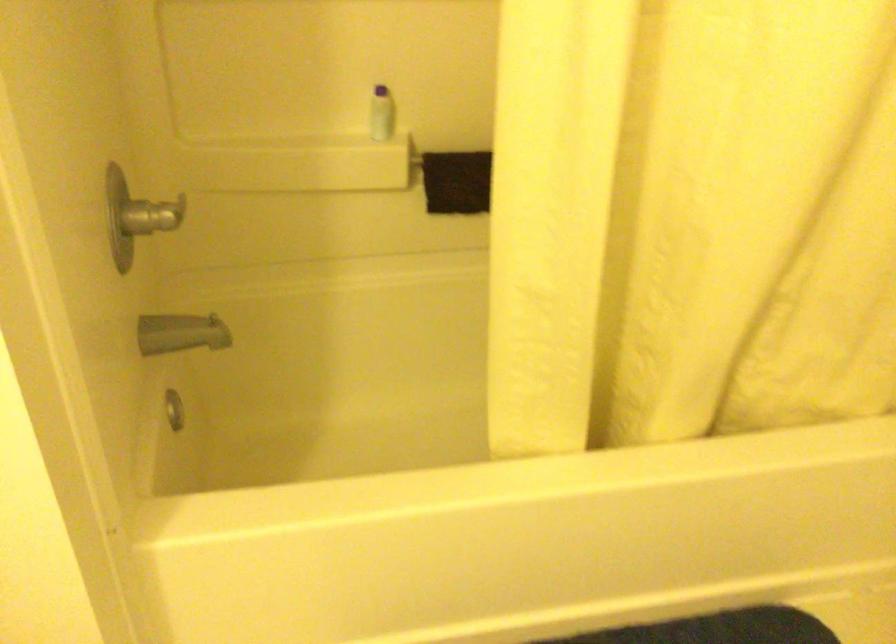
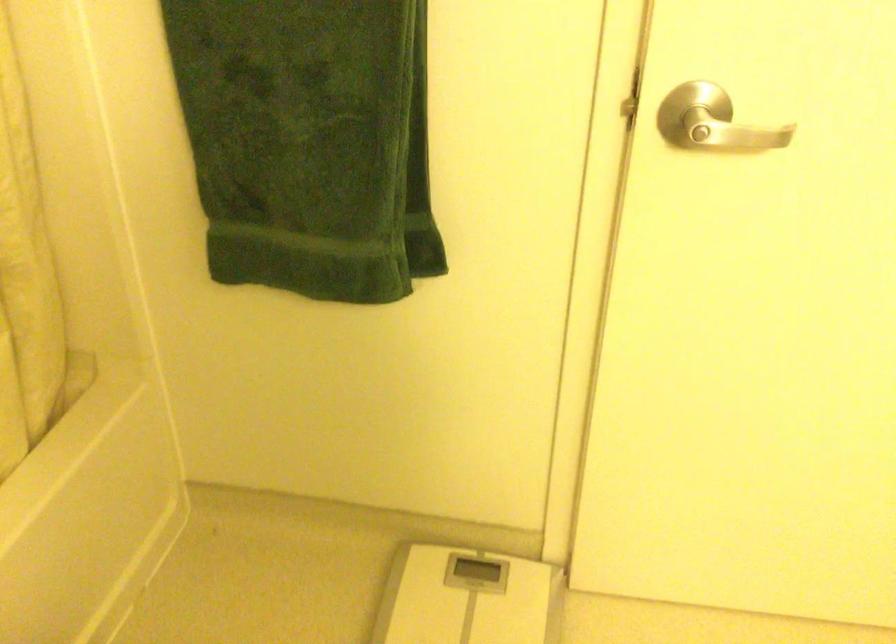
How did the camera likely rotate?

The camera's rotation is toward right-down.